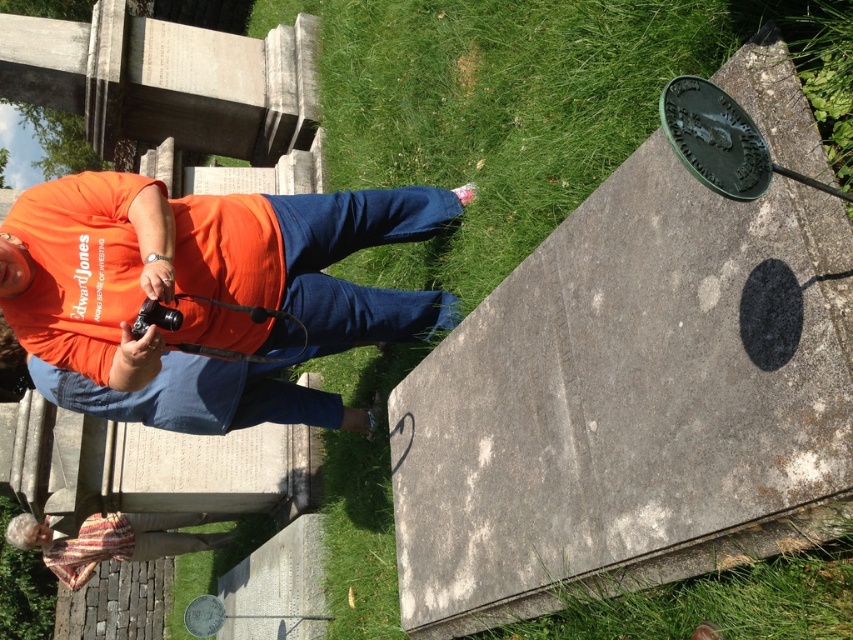
Question: Among these objects, which one is farthest from the camera?

Choices:
 (A) striped fabric at lower left
 (B) gray stone marker at upper right

Answer: (A)

Question: Among these objects, which one is farthest from the camera?

Choices:
 (A) gray stone marker at upper right
 (B) striped fabric at lower left

Answer: (B)

Question: From the image, what is the correct spatial relationship of gray stone marker at upper right in relation to striped fabric at lower left?

Choices:
 (A) right
 (B) left

Answer: (A)

Question: Which object is positioned closest to the gray stone marker at upper right?

Choices:
 (A) striped fabric at lower left
 (B) orange cotton shirt at center

Answer: (B)

Question: Is gray stone marker at upper right below orange cotton shirt at center?

Choices:
 (A) no
 (B) yes

Answer: (B)

Question: Is gray stone marker at upper right further to the viewer compared to striped fabric at lower left?

Choices:
 (A) yes
 (B) no

Answer: (B)